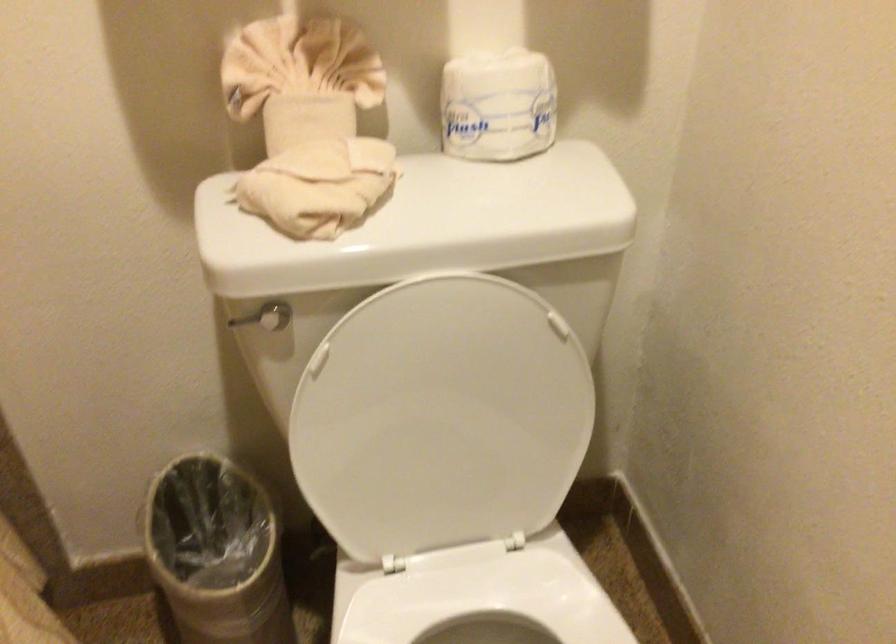
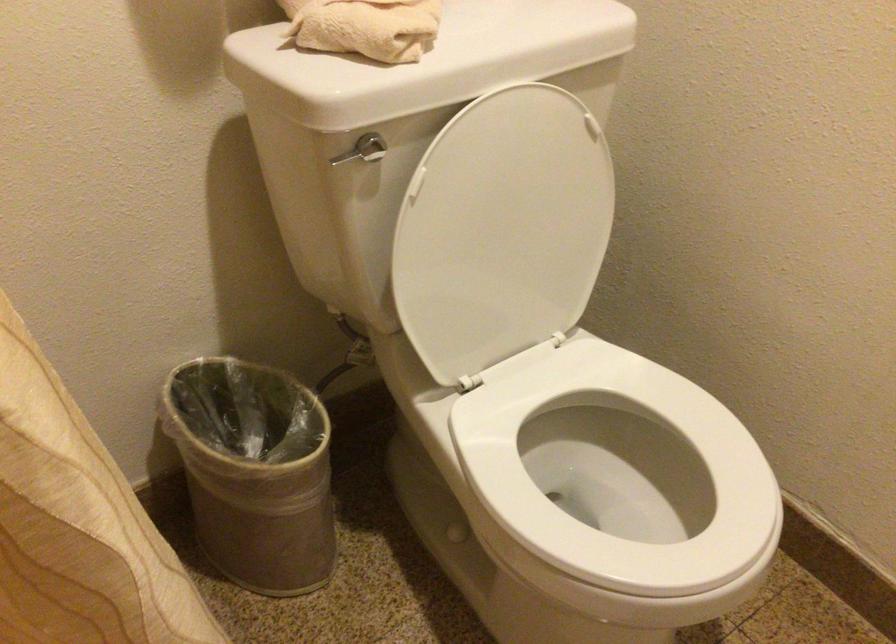
Where in the second image is the point corresponding to (x=440, y=417) from the first image?

(502, 230)